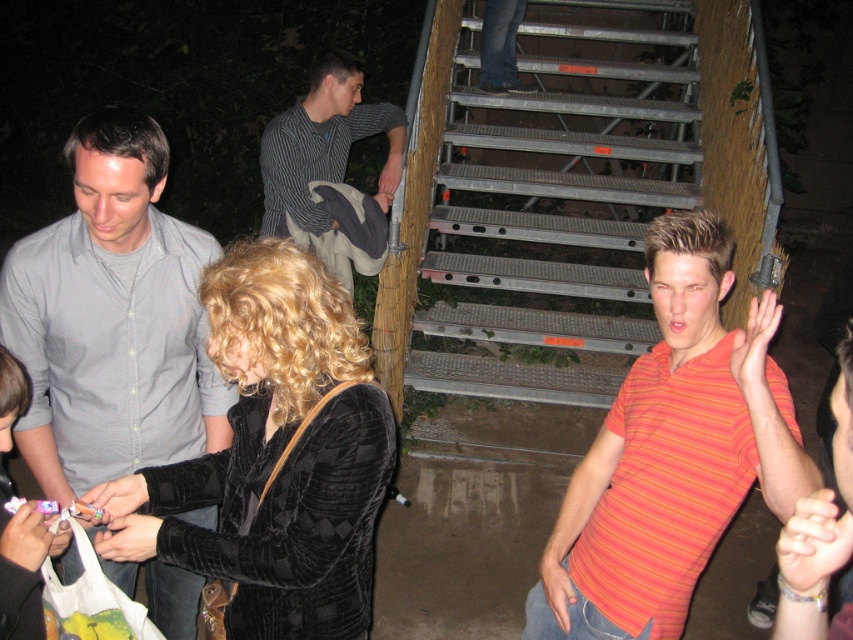
Can you confirm if metallic gray stairs at upper center is bigger than gray cotton shirt at center?

Yes, metallic gray stairs at upper center is bigger than gray cotton shirt at center.

Does metallic gray stairs at upper center lie in front of gray cotton shirt at center?

No, it is behind gray cotton shirt at center.

Does point (674, 161) lie in front of point (47, 316)?

That is False.

Locate an element on the screen. Image resolution: width=853 pixels, height=640 pixels. metallic gray stairs at upper center is located at coordinates (560, 202).

Is gray cotton shirt at center further to the viewer compared to striped shirt at upper center?

No.

Does gray cotton shirt at center appear on the left side of striped shirt at upper center?

Indeed, gray cotton shirt at center is positioned on the left side of striped shirt at upper center.

Does point (16, 321) lie in front of point (318, 77)?

Yes, it is.

What are the coordinates of `gray cotton shirt at center` in the screenshot? It's located at (112, 320).

Does point (144, 556) lie in front of point (173, 400)?

Yes, it is.

This screenshot has height=640, width=853. Describe the element at coordinates (274, 458) in the screenshot. I see `velvet black jacket at center` at that location.

Locate an element on the screen. The height and width of the screenshot is (640, 853). velvet black jacket at center is located at coordinates (274, 458).